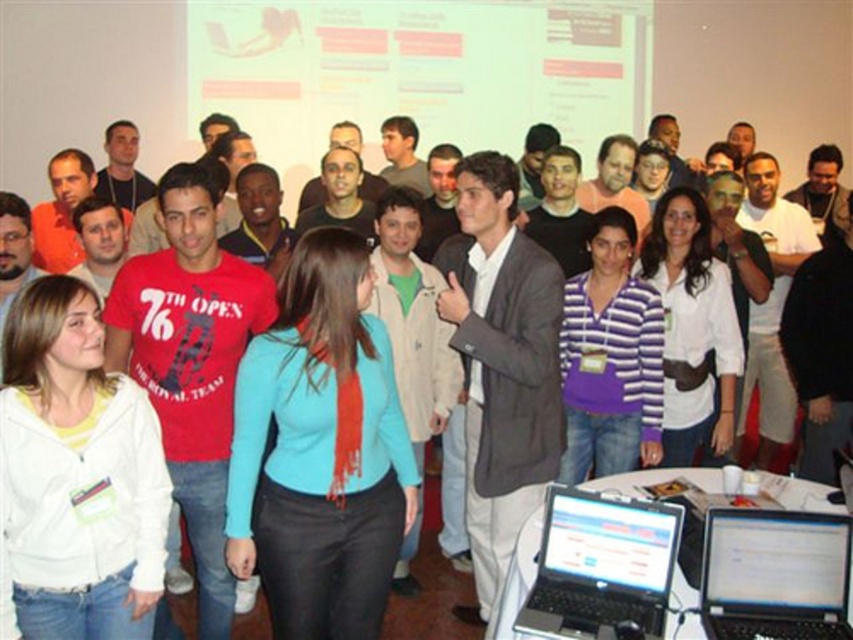
You are organizing a tech workshop and need to set up two laptops for a demo. You have a silver metallic laptop at lower center and a black plastic laptop at lower right. According to their positions in the image, which laptop should you move to the right side of the demo table to align with the presentation screen on the left wall?

You should move the black plastic laptop at lower right to the right side of the demo table because the silver metallic laptop at lower center is already to the left of it, meaning the black plastic laptop is positioned further to the right. Aligning the black plastic laptop at lower right on the right side would maintain their relative positions as shown.

You are organizing a tech event and need to place both the silver metallic laptop at lower center and the black plastic laptop at lower right on a narrow table. The table has just enough space for one of them. Based on their sizes, which laptop should you choose to fit on the table?

The silver metallic laptop at lower center might be wider than black plastic laptop at lower right, so you should choose the black plastic laptop at lower right to fit on the narrow table.